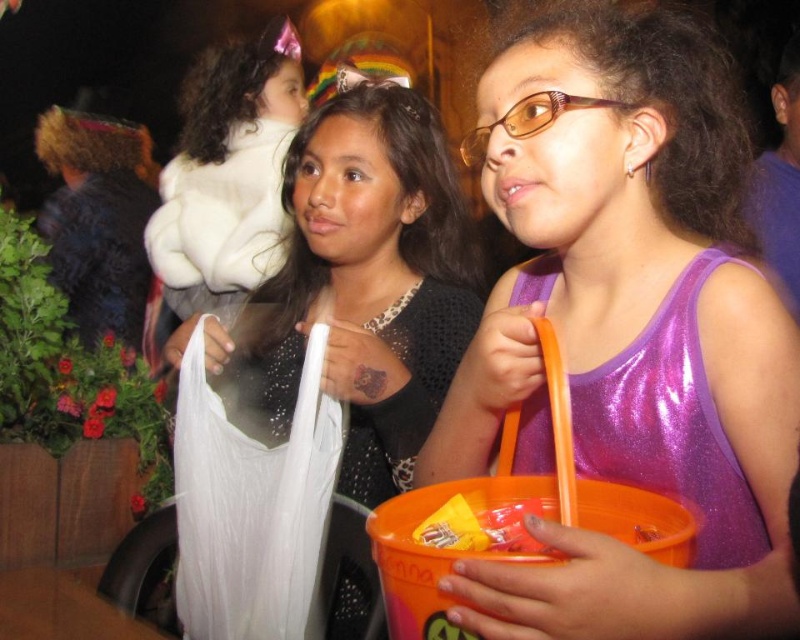
Question: Which is farther from the shiny purple dress at center?

Choices:
 (A) white fluffy coat at upper left
 (B) purple shiny tank top at center

Answer: (A)

Question: Can you confirm if purple shiny tank top at center is bigger than shiny purple dress at center?

Choices:
 (A) no
 (B) yes

Answer: (B)

Question: Based on their relative distances, which object is farther from the shiny purple dress at center?

Choices:
 (A) purple shiny tank top at center
 (B) white matte plastic bag at center

Answer: (B)

Question: Can you confirm if shiny purple dress at center is bigger than white fluffy coat at upper left?

Choices:
 (A) no
 (B) yes

Answer: (A)

Question: Is purple shiny tank top at center smaller than white matte plastic bag at center?

Choices:
 (A) yes
 (B) no

Answer: (A)

Question: Which object is closer to the camera taking this photo?

Choices:
 (A) white matte plastic bag at center
 (B) purple shiny tank top at center
 (C) white fluffy coat at upper left
 (D) shiny purple dress at center

Answer: (B)